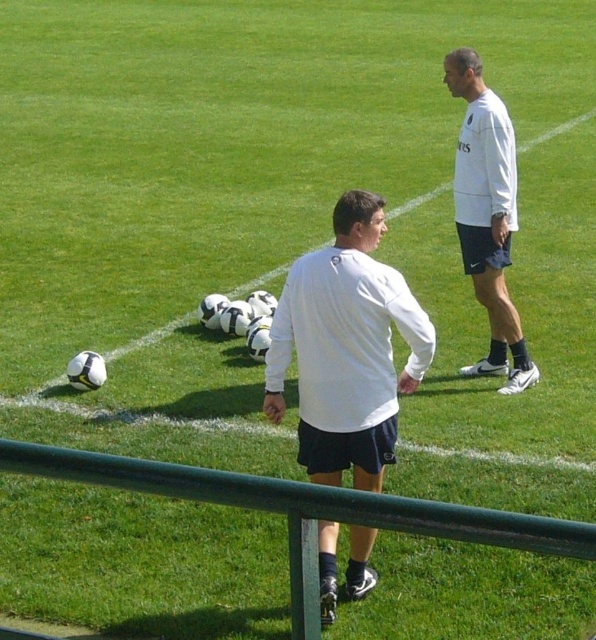
You are a soccer coach analyzing a training session. You notice the green metal rail at lower center and the white matte shirt at upper right in the image. Which object takes up more visual space in the image?

The white matte shirt at upper right takes up more visual space in the image because the green metal rail at lower center is smaller than it.

You are a soccer coach standing at the edge of the field. You notice a white matte shirt at center and a green metal rail at lower center. Which object is closer to your right side?

The white matte shirt at center is to the right of the green metal rail at lower center, so it is closer to your right side.